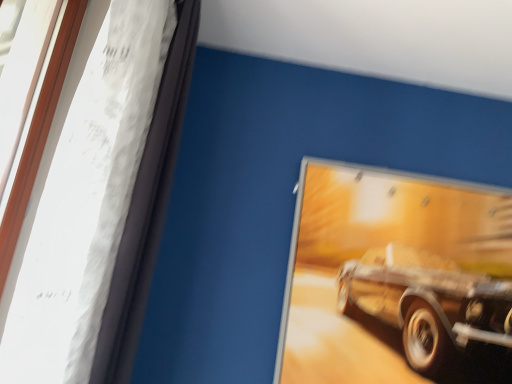
Question: Is metallic gold car at upper right positioned in front of wooden frame at left?

Choices:
 (A) no
 (B) yes

Answer: (A)

Question: Is metallic gold car at upper right to the left of wooden frame at left from the viewer's perspective?

Choices:
 (A) no
 (B) yes

Answer: (A)

Question: From the image's perspective, is metallic gold car at upper right above wooden frame at left?

Choices:
 (A) yes
 (B) no

Answer: (B)

Question: Considering the relative sizes of metallic gold car at upper right and wooden frame at left in the image provided, is metallic gold car at upper right shorter than wooden frame at left?

Choices:
 (A) no
 (B) yes

Answer: (B)

Question: Could you tell me if metallic gold car at upper right is facing wooden frame at left?

Choices:
 (A) no
 (B) yes

Answer: (A)

Question: From the image's perspective, does metallic gold car at upper right appear lower than wooden frame at left?

Choices:
 (A) no
 (B) yes

Answer: (B)

Question: Is wooden frame at left aimed at metallic gold car at upper right?

Choices:
 (A) yes
 (B) no

Answer: (B)

Question: Is wooden frame at left thinner than metallic gold car at upper right?

Choices:
 (A) yes
 (B) no

Answer: (B)

Question: Considering the relative sizes of wooden frame at left and metallic gold car at upper right in the image provided, is wooden frame at left taller than metallic gold car at upper right?

Choices:
 (A) yes
 (B) no

Answer: (A)

Question: Is wooden frame at left outside metallic gold car at upper right?

Choices:
 (A) no
 (B) yes

Answer: (B)

Question: Is wooden frame at left with metallic gold car at upper right?

Choices:
 (A) yes
 (B) no

Answer: (B)

Question: From the image's perspective, would you say wooden frame at left is positioned over metallic gold car at upper right?

Choices:
 (A) no
 (B) yes

Answer: (B)

Question: Does point (97, 321) appear closer or farther from the camera than point (424, 288)?

Choices:
 (A) closer
 (B) farther

Answer: (A)